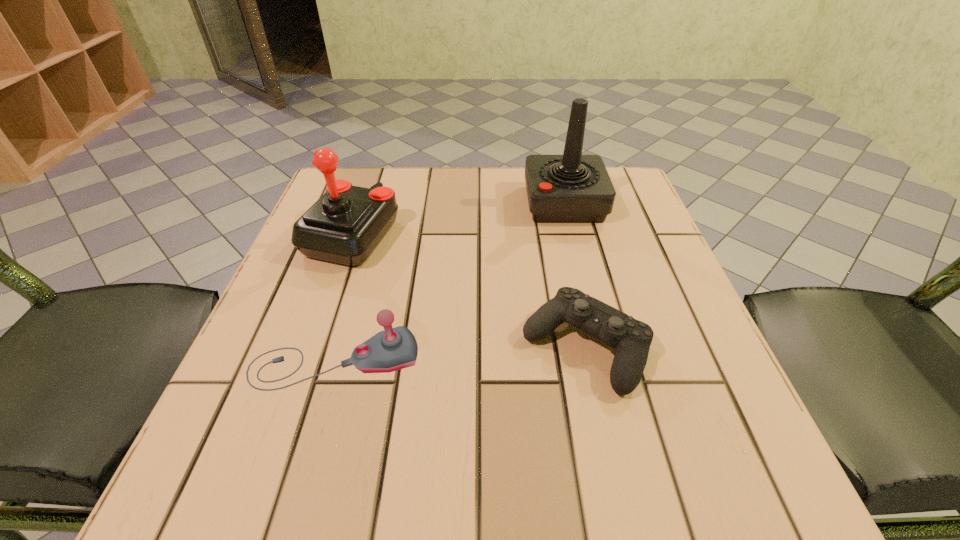
What are the coordinates of `joystick that is the closest one to the shortest object` in the screenshot? It's located at [x=393, y=349].

At what (x,y) coordinates should I click in order to perform the action: click on free point that satisfies the following two spatial constraints: 1. on the front-facing side of the rightmost joystick; 2. on the front side of the control. Please return your answer as a coordinate pair (x, y). The image size is (960, 540). Looking at the image, I should click on (600, 347).

This screenshot has height=540, width=960. In order to click on vacant space that satisfies the following two spatial constraints: 1. on the back side of the nearest joystick; 2. on the left side of the shortest object in this screenshot , I will do `click(339, 347)`.

Find the location of a particular element. vacant point that satisfies the following two spatial constraints: 1. on the front-facing side of the rightmost joystick; 2. on the front side of the control is located at coordinates (600, 347).